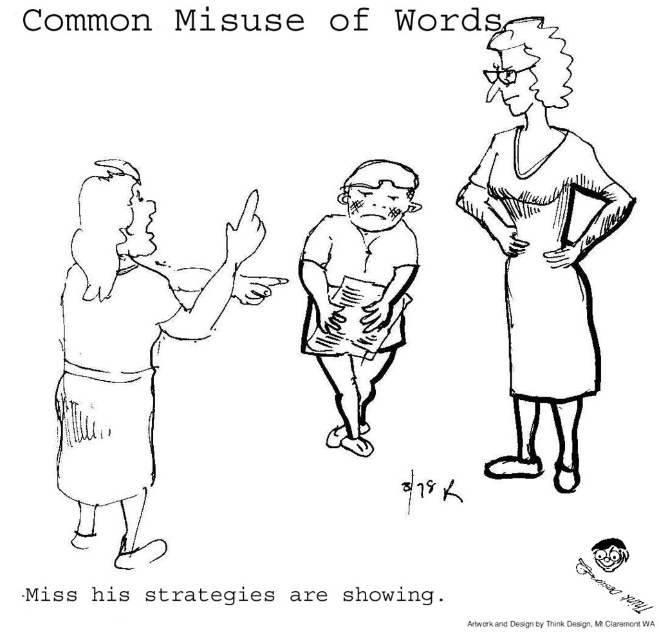
Locate an element on the screen. smooth skin man at left is located at coordinates (123, 348).

I want to click on smooth skin man at left, so coord(123,348).

I want to click on smooth skin man at left, so click(x=123, y=348).

Which is behind, point (569, 305) or point (353, 417)?

The point (353, 417) is behind.

In order to click on matte black dress at right in this screenshot , I will do `click(542, 243)`.

This screenshot has width=659, height=640. I want to click on matte black dress at right, so point(542,243).

Is matte black dress at right further to camera compared to smooth skin man at left?

That is True.

Find the location of a particular element. matte black dress at right is located at coordinates pos(542,243).

The image size is (659, 640). I want to click on matte black dress at right, so click(542, 243).

Where is `matte black dress at right`? This screenshot has width=659, height=640. matte black dress at right is located at coordinates 542,243.